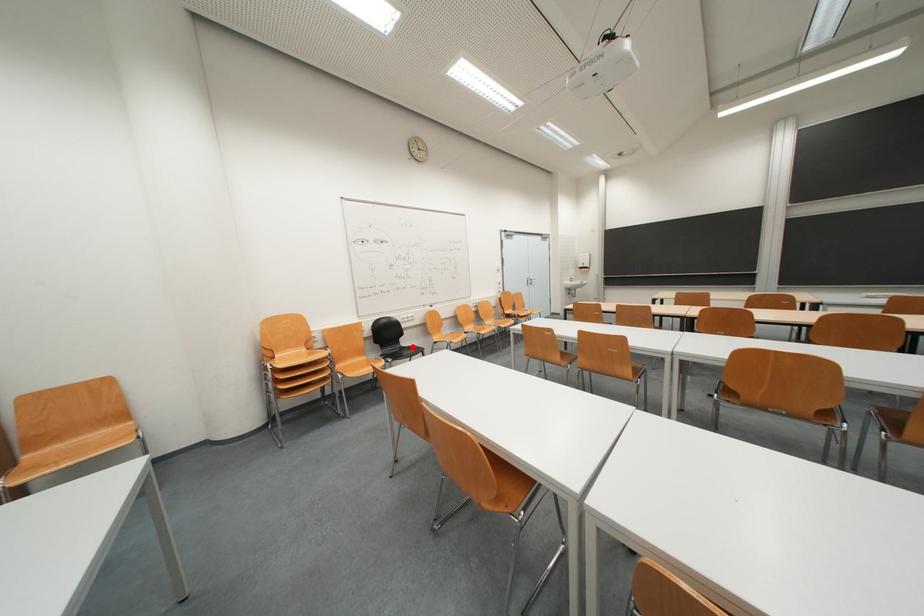
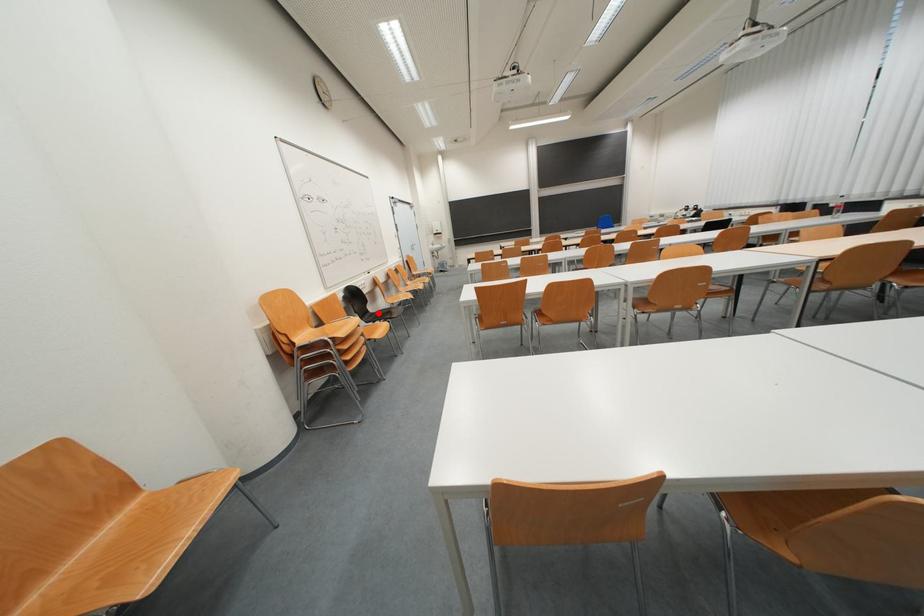
I am providing you with two images of the same scene from different viewpoints. A red point is marked on the first image and another point is marked on the second image. Does the point marked in image1 correspond to the same location as the one in image2?

Yes